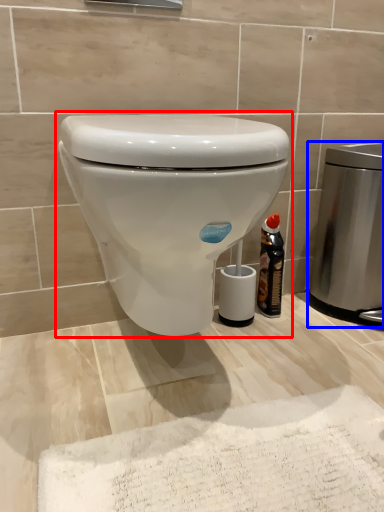
Question: Which of the following is the farthest to the observer, toilet (highlighted by a red box) or appliance (highlighted by a blue box)?

Choices:
 (A) toilet
 (B) appliance

Answer: (B)